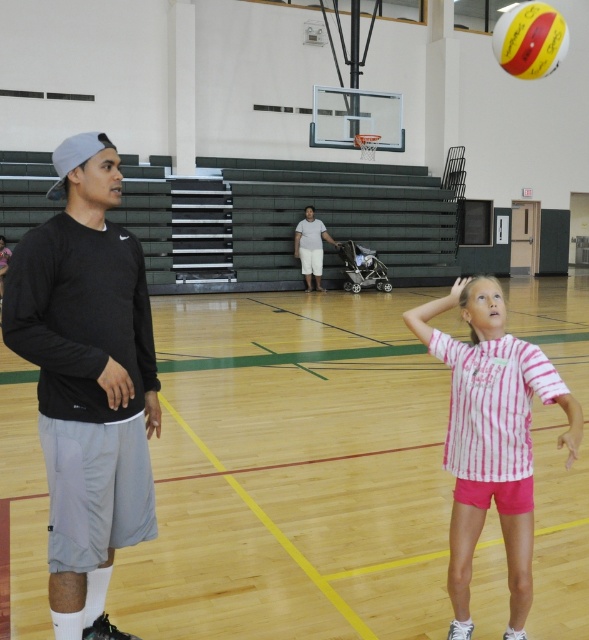
Question: Which object appears farthest from the camera in this image?

Choices:
 (A) yellow matte volleyball at upper right
 (B) white cotton shirt at center
 (C) black matte long-sleeve shirt at left
 (D) pink striped shirt at center

Answer: (B)

Question: Is pink striped shirt at center above white cotton shirt at center?

Choices:
 (A) no
 (B) yes

Answer: (A)

Question: Is black matte long-sleeve shirt at left bigger than yellow matte volleyball at upper right?

Choices:
 (A) no
 (B) yes

Answer: (B)

Question: Considering the real-world distances, which object is farthest from the white cotton shirt at center?

Choices:
 (A) black matte long-sleeve shirt at left
 (B) pink striped shirt at center

Answer: (A)

Question: Does pink striped shirt at center appear on the right side of yellow matte volleyball at upper right?

Choices:
 (A) yes
 (B) no

Answer: (B)

Question: Among these objects, which one is farthest from the camera?

Choices:
 (A) yellow matte volleyball at upper right
 (B) white cotton shirt at center
 (C) black matte long-sleeve shirt at left
 (D) pink striped shirt at center

Answer: (B)